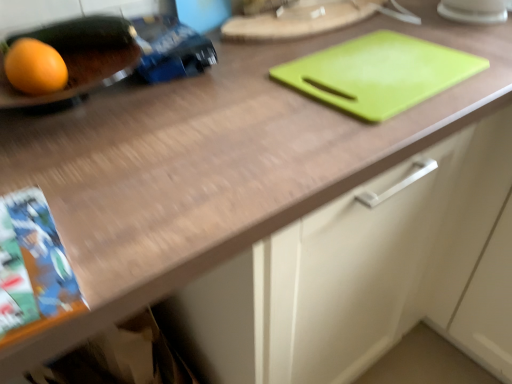
Question: Is green plastic cutting board at upper right, which appears as the first tray when viewed from the right, further to the viewer compared to matte black tray at left, the 3th tray when ordered from right to left?

Choices:
 (A) no
 (B) yes

Answer: (B)

Question: Does green plastic cutting board at upper right, the 3th tray in the left-to-right sequence, contain matte black tray at left, the 3th tray when ordered from right to left?

Choices:
 (A) no
 (B) yes

Answer: (A)

Question: Is green plastic cutting board at upper right, which appears as the first tray when viewed from the right, positioned with its back to matte black tray at left, the 3th tray when ordered from right to left?

Choices:
 (A) no
 (B) yes

Answer: (A)

Question: Considering the relative sizes of green plastic cutting board at upper right, the 3th tray in the left-to-right sequence, and matte black tray at left, the 3th tray when ordered from right to left, in the image provided, is green plastic cutting board at upper right, the 3th tray in the left-to-right sequence, shorter than matte black tray at left, the 3th tray when ordered from right to left,?

Choices:
 (A) no
 (B) yes

Answer: (B)

Question: Does green plastic cutting board at upper right, the 3th tray in the left-to-right sequence, have a greater height compared to matte black tray at left, arranged as the first tray when viewed from the left?

Choices:
 (A) no
 (B) yes

Answer: (A)

Question: From the image's perspective, is green plastic cutting board at upper center, the second tray from the left, positioned above or below orange matte grapefruit at left?

Choices:
 (A) below
 (B) above

Answer: (B)

Question: Is green plastic cutting board at upper center, the second tray from the left, to the left or to the right of orange matte grapefruit at left in the image?

Choices:
 (A) left
 (B) right

Answer: (B)

Question: Is green plastic cutting board at upper center, the second tray from the left, wider or thinner than orange matte grapefruit at left?

Choices:
 (A) wide
 (B) thin

Answer: (A)

Question: Considering their positions, is green plastic cutting board at upper center, which appears as the 2th tray when viewed from the right, located in front of or behind orange matte grapefruit at left?

Choices:
 (A) behind
 (B) front

Answer: (A)

Question: Considering the relative positions of matte black tray at left, arranged as the first tray when viewed from the left, and green plastic cutting board at upper center, which appears as the 2th tray when viewed from the right, in the image provided, is matte black tray at left, arranged as the first tray when viewed from the left, to the left or to the right of green plastic cutting board at upper center, which appears as the 2th tray when viewed from the right,?

Choices:
 (A) left
 (B) right

Answer: (A)

Question: Is matte black tray at left, arranged as the first tray when viewed from the left, taller or shorter than green plastic cutting board at upper center, which appears as the 2th tray when viewed from the right?

Choices:
 (A) short
 (B) tall

Answer: (B)

Question: From the image's perspective, is matte black tray at left, the 3th tray when ordered from right to left, positioned above or below green plastic cutting board at upper center, the second tray from the left?

Choices:
 (A) below
 (B) above

Answer: (A)

Question: Considering the positions of matte black tray at left, the 3th tray when ordered from right to left, and green plastic cutting board at upper center, which appears as the 2th tray when viewed from the right, in the image, is matte black tray at left, the 3th tray when ordered from right to left, bigger or smaller than green plastic cutting board at upper center, which appears as the 2th tray when viewed from the right,?

Choices:
 (A) big
 (B) small

Answer: (B)

Question: Is orange matte grapefruit at left taller or shorter than green plastic cutting board at upper right, which appears as the first tray when viewed from the right?

Choices:
 (A) tall
 (B) short

Answer: (A)

Question: Choose the correct answer: Is orange matte grapefruit at left inside green plastic cutting board at upper right, which appears as the first tray when viewed from the right, or outside it?

Choices:
 (A) outside
 (B) inside

Answer: (A)